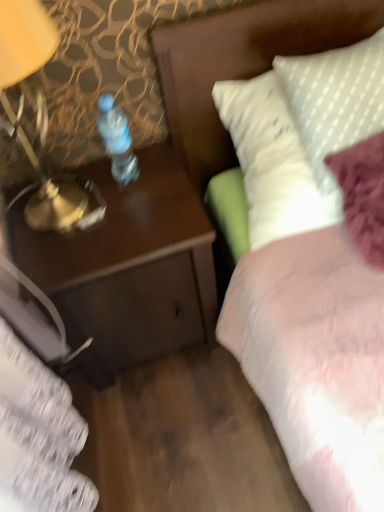
Question: From a real-world perspective, is brown wood desk at left above or below clear plastic bottle at center?

Choices:
 (A) below
 (B) above

Answer: (A)

Question: Is brown wood desk at left taller or shorter than clear plastic bottle at center?

Choices:
 (A) short
 (B) tall

Answer: (B)

Question: Which object is positioned closest to the gold metallic lamp at left?

Choices:
 (A) brown wood desk at left
 (B) clear plastic bottle at center
 (C) white dotted pillow at upper right
 (D) white dotted fabric at upper right

Answer: (B)

Question: Which is farther from the white dotted pillow at upper right?

Choices:
 (A) gold metallic lamp at left
 (B) clear plastic bottle at center
 (C) white dotted fabric at upper right
 (D) brown wood desk at left

Answer: (A)